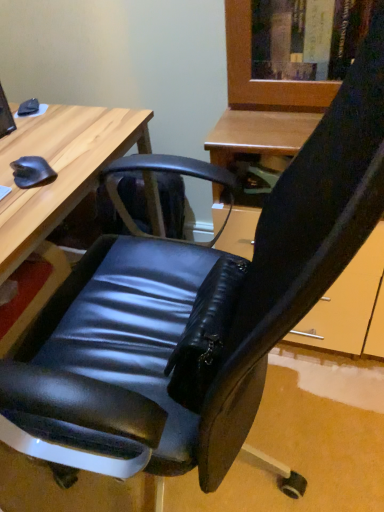
Question: Is matte black monitor at upper left bigger or smaller than wooden desk at left?

Choices:
 (A) small
 (B) big

Answer: (A)

Question: Considering their positions, is matte black monitor at upper left located in front of or behind wooden desk at left?

Choices:
 (A) front
 (B) behind

Answer: (B)

Question: Looking at their shapes, would you say matte black monitor at upper left is wider or thinner than wooden desk at left?

Choices:
 (A) wide
 (B) thin

Answer: (B)

Question: Is wooden desk at left situated inside matte black monitor at upper left or outside?

Choices:
 (A) outside
 (B) inside

Answer: (A)

Question: From a real-world perspective, is wooden desk at left physically located above or below matte black monitor at upper left?

Choices:
 (A) above
 (B) below

Answer: (B)

Question: In the image, is wooden desk at left positioned in front of or behind matte black monitor at upper left?

Choices:
 (A) behind
 (B) front

Answer: (B)

Question: Is wooden desk at left bigger or smaller than matte black monitor at upper left?

Choices:
 (A) small
 (B) big

Answer: (B)